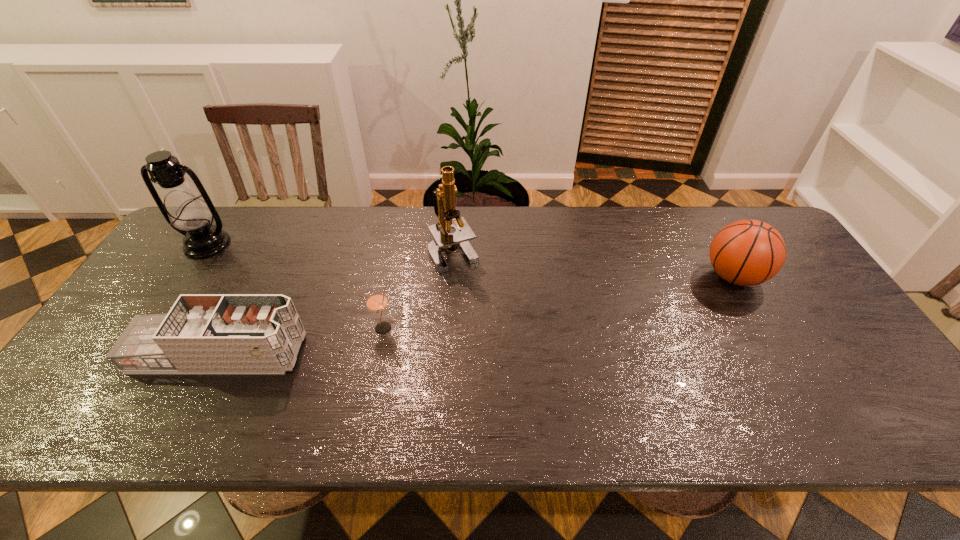
Find the location of `oil lamp that is at the far edge`. oil lamp that is at the far edge is located at coordinates (184, 209).

This screenshot has width=960, height=540. In order to click on microscope located in the far edge section of the desktop in this screenshot , I will do `click(444, 197)`.

This screenshot has height=540, width=960. Find the location of `oil lamp present at the left edge`. oil lamp present at the left edge is located at coordinates (184, 209).

Find the location of a particular element. This screenshot has height=540, width=960. dollhouse located at the left edge is located at coordinates (213, 333).

The height and width of the screenshot is (540, 960). Identify the location of object at the right edge. (747, 252).

The width and height of the screenshot is (960, 540). What are the coordinates of `object that is positioned at the far left corner` in the screenshot? It's located at (184, 209).

Find the location of `vacant space at the far edge`. vacant space at the far edge is located at coordinates (564, 221).

Identify the location of free space at the near edge. (762, 404).

Find the location of a particular element. free space at the left edge of the desktop is located at coordinates (165, 307).

The image size is (960, 540). In the image, there is a desktop. In order to click on vacant space at the far left corner in this screenshot , I will do `click(240, 210)`.